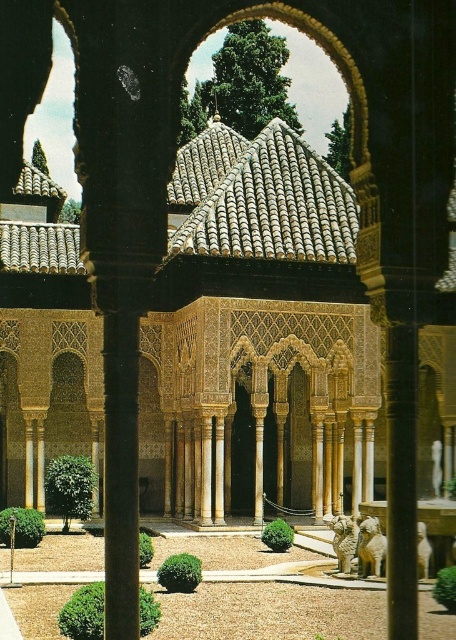
Can you confirm if brown textured gravel at center is taller than white marble column at center?

Yes.

Is point (377, 618) closer to viewer compared to point (203, 484)?

That is True.

Who is more distant from viewer, (258, 579) or (207, 456)?

The point (207, 456) is behind.

The width and height of the screenshot is (456, 640). Identify the location of brown textured gravel at center. 259,596.